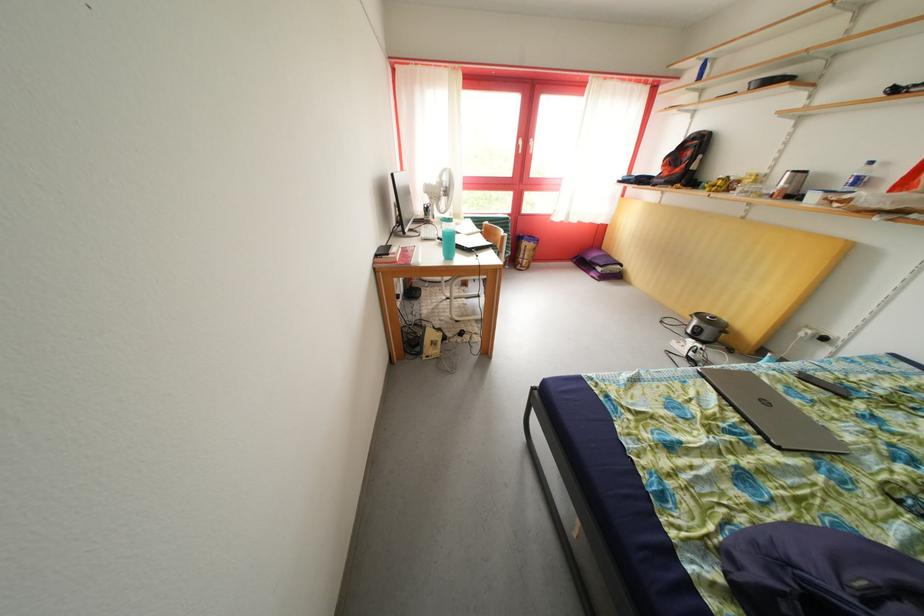
Where would you lift the black remote control? Please return your answer as a coordinate pair (x, y).

(822, 384)